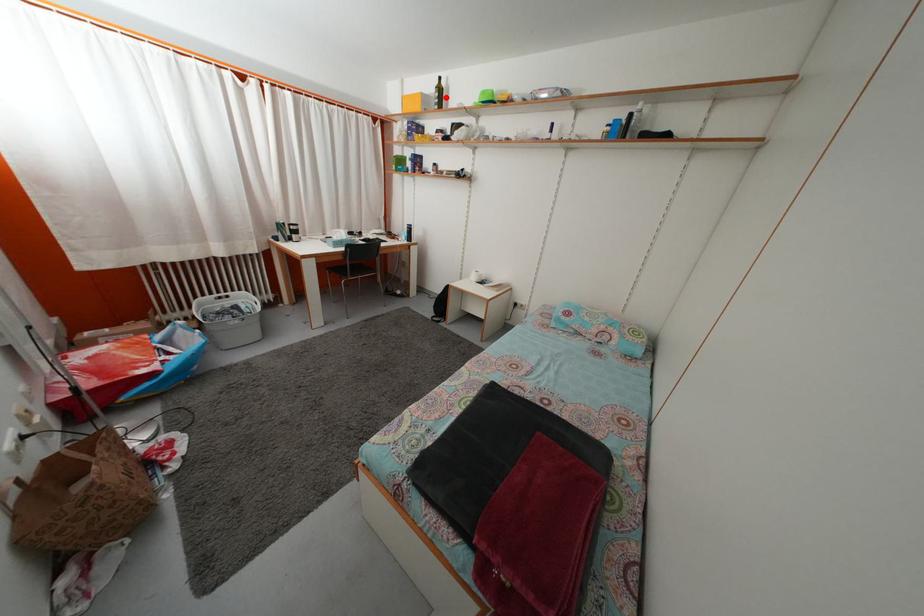
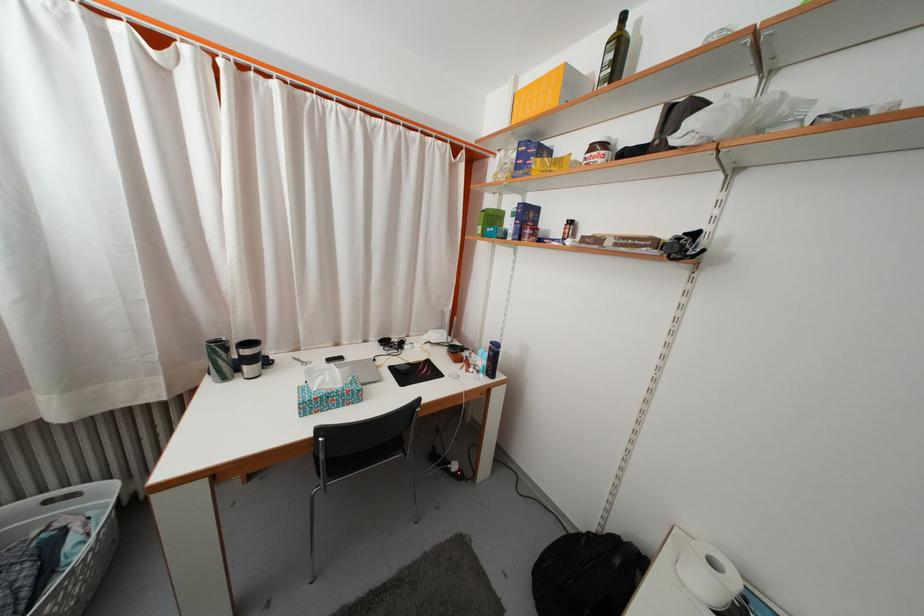
Locate, in the second image, the point that corresponds to the highlighted location in the first image.

(625, 54)